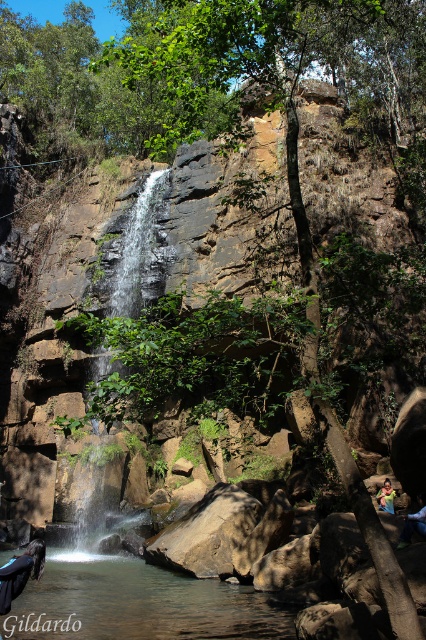
This screenshot has width=426, height=640. Describe the element at coordinates (137, 604) in the screenshot. I see `clear water at center` at that location.

Does point (238, 588) come in front of point (388, 483)?

That is True.

Who is more distant from viewer, (28, 636) or (391, 486)?

Point (391, 486)

You are a GUI agent. You are given a task and a screenshot of the screen. Output one action in this format:
    pyautogui.click(x=<x>, y=<y>)
    Task: Click on the clear water at center
    
    Given the screenshot: What is the action you would take?
    pyautogui.click(x=137, y=604)

Between point (114, 465) and point (40, 552), which one is positioned in front?

Point (40, 552)

Between point (121, 433) and point (14, 593), which one is positioned in front?

Positioned in front is point (14, 593).

Find the location of a particular element. This screenshot has height=640, width=426. smooth rock waterfall at center is located at coordinates (104, 481).

Does point (16, 579) come farther from viewer compared to point (385, 490)?

No, (16, 579) is closer to viewer.

Which is above, dark blue fabric at center or blue denim shorts at lower right?

blue denim shorts at lower right is higher up.

Is point (2, 577) farther from viewer compared to point (379, 506)?

No, (2, 577) is in front of (379, 506).

At what (x,y) coordinates should I click in order to perform the action: click on dark blue fabric at center. Please return your answer as a coordinate pair (x, y). The image size is (426, 640). Looking at the image, I should click on (20, 572).